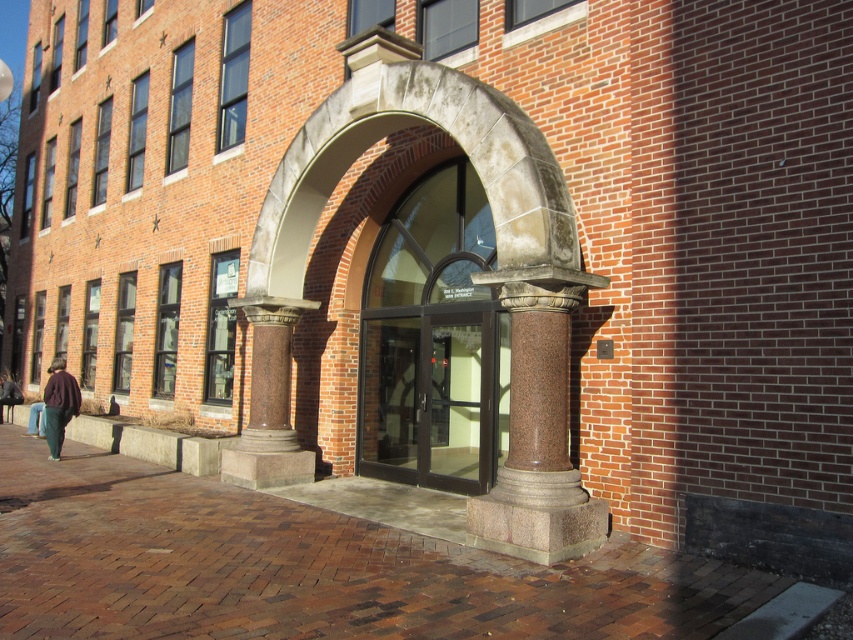
Describe the element at coordinates (473, 275) in the screenshot. The height and width of the screenshot is (640, 853). I see `polished stone archway at center` at that location.

Is polished stone archway at center taller than brown granite column at center?

In fact, polished stone archway at center may be shorter than brown granite column at center.

Where is `polished stone archway at center`? Image resolution: width=853 pixels, height=640 pixels. polished stone archway at center is located at coordinates (473, 275).

Which of these two, polished stone archway at center or dark brown sweater at lower left, stands shorter?

polished stone archway at center

Which is in front, point (276, 268) or point (61, 371)?

Point (276, 268)

The image size is (853, 640). Identify the location of polished stone archway at center. click(473, 275).

Consider the image. Can you confirm if polished stone archway at center is positioned to the left of brown polished stone column at center?

Indeed, polished stone archway at center is positioned on the left side of brown polished stone column at center.

Where is `polished stone archway at center`? polished stone archway at center is located at coordinates (473, 275).

Image resolution: width=853 pixels, height=640 pixels. What are the coordinates of `polished stone archway at center` in the screenshot? It's located at (473, 275).

You are a GUI agent. You are given a task and a screenshot of the screen. Output one action in this format:
    pyautogui.click(x=<x>, y=<y>)
    Task: Click on the polished stone archway at center
    The height and width of the screenshot is (640, 853).
    Given the screenshot: What is the action you would take?
    pyautogui.click(x=473, y=275)